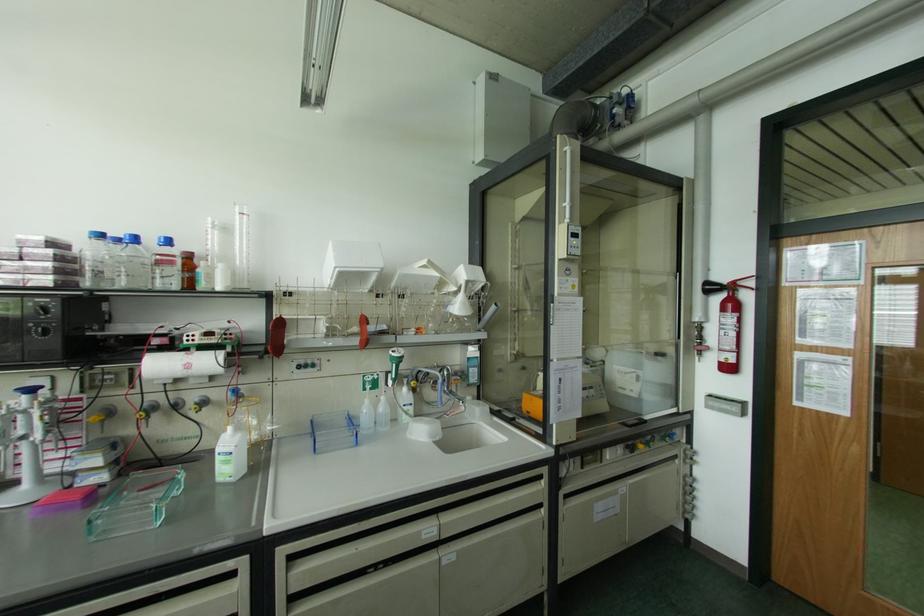
Find where to squeez the extinguisher lever. Please return your answer as a coordinate pair (x, y).

(742, 283)